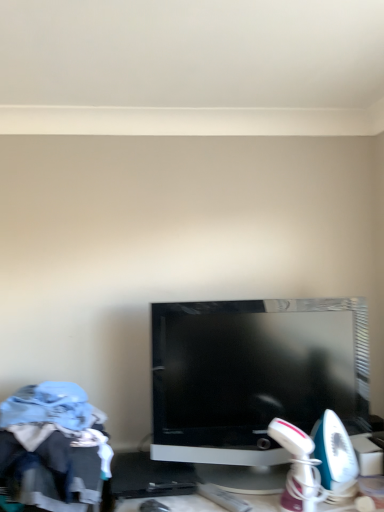
The width and height of the screenshot is (384, 512). What do you see at coordinates (53, 473) in the screenshot?
I see `light blue fabric at lower left` at bounding box center [53, 473].

Measure the distance between point (75, 490) and camera.

Point (75, 490) and camera are 3.85 feet apart.

What is the approximate width of light blue fabric at lower left?

The width of light blue fabric at lower left is 19.03 inches.

This screenshot has height=512, width=384. Identify the location of light blue fabric at lower left. click(53, 473).

What do you see at coordinates (253, 381) in the screenshot? This screenshot has width=384, height=512. I see `black glossy television at center` at bounding box center [253, 381].

Identify the location of black glossy television at center. This screenshot has width=384, height=512. (253, 381).

What is the approximate width of black glossy television at center?

black glossy television at center is 10.66 inches wide.

Locate an element on the screen. light blue fabric at lower left is located at coordinates (53, 473).

Which object is positioned more to the right, black glossy television at center or light blue fabric at lower left?

Positioned to the right is black glossy television at center.

Which object is closer to the camera taking this photo, black glossy television at center or light blue fabric at lower left?

light blue fabric at lower left.

Which point is more forward, (291, 421) or (2, 471)?

The point (2, 471) is closer to the camera.

From the image's perspective, which is above, black glossy television at center or light blue fabric at lower left?

black glossy television at center, from the image's perspective.

From a real-world perspective, is black glossy television at center on light blue fabric at lower left?

Correct, in the physical world, black glossy television at center is higher than light blue fabric at lower left.

Which of these two, black glossy television at center or light blue fabric at lower left, is thinner?

black glossy television at center is thinner.

Considering the relative sizes of black glossy television at center and light blue fabric at lower left in the image provided, is black glossy television at center shorter than light blue fabric at lower left?

No, black glossy television at center is not shorter than light blue fabric at lower left.

Who is smaller, black glossy television at center or light blue fabric at lower left?

light blue fabric at lower left.

Is black glossy television at center outside of light blue fabric at lower left?

Yes, black glossy television at center is located beyond the bounds of light blue fabric at lower left.

Is black glossy television at center positioned far away from light blue fabric at lower left?

No.

Is black glossy television at center oriented towards light blue fabric at lower left?

No, black glossy television at center is not turned towards light blue fabric at lower left.

The image size is (384, 512). In order to click on clothing below the black glossy television at center (from a real-world perspective) in this screenshot , I will do `click(53, 473)`.

Which is more to the right, light blue fabric at lower left or black glossy television at center?

Positioned to the right is black glossy television at center.

Relative to black glossy television at center, is light blue fabric at lower left in front or behind?

light blue fabric at lower left is in front of black glossy television at center.

Between point (31, 457) and point (339, 301), which one is positioned behind?

Point (339, 301)

From the image's perspective, is light blue fabric at lower left above black glossy television at center?

No, from the image's perspective, light blue fabric at lower left is not over black glossy television at center.

From a real-world perspective, which object rests below the other?

light blue fabric at lower left.

In terms of width, does light blue fabric at lower left look wider or thinner when compared to black glossy television at center?

Clearly, light blue fabric at lower left has more width compared to black glossy television at center.

Is light blue fabric at lower left shorter than black glossy television at center?

Correct, light blue fabric at lower left is not as tall as black glossy television at center.

Consider the image. Who is bigger, light blue fabric at lower left or black glossy television at center?

black glossy television at center.

Is light blue fabric at lower left not inside black glossy television at center?

Yes, light blue fabric at lower left is outside of black glossy television at center.

Is light blue fabric at lower left with black glossy television at center?

No, light blue fabric at lower left is not beside black glossy television at center.

Looking at this image, is light blue fabric at lower left looking in the opposite direction of black glossy television at center?

No.

How many degrees apart are the facing directions of light blue fabric at lower left and black glossy television at center?

There is a 1.94-degree angle between the facing directions of light blue fabric at lower left and black glossy television at center.

This screenshot has height=512, width=384. Find the location of `television that appears above the light blue fabric at lower left (from the image's perspective)`. television that appears above the light blue fabric at lower left (from the image's perspective) is located at coordinates (253, 381).

Image resolution: width=384 pixels, height=512 pixels. In order to click on clothing on the left of black glossy television at center in this screenshot , I will do `click(53, 473)`.

Where is `television above the light blue fabric at lower left (from the image's perspective)`? This screenshot has height=512, width=384. television above the light blue fabric at lower left (from the image's perspective) is located at coordinates (253, 381).